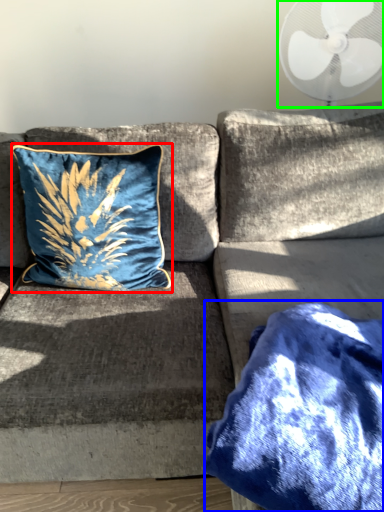
Question: Considering the real-world distances, which object is farthest from pillow (highlighted by a red box)? blanket (highlighted by a blue box) or mechanical fan (highlighted by a green box)?

Choices:
 (A) blanket
 (B) mechanical fan

Answer: (B)